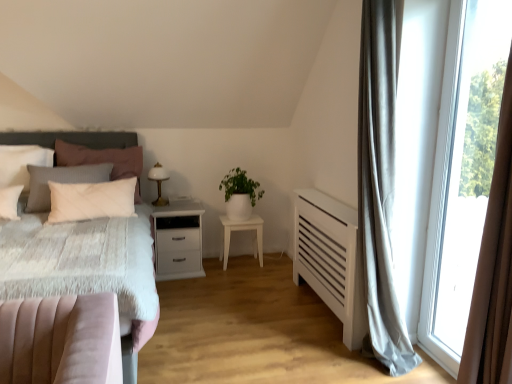
The image size is (512, 384). Find the location of `vacant region below white matte nightstand at center, the 2th nightstand from the left (from a real-world perspective)`. vacant region below white matte nightstand at center, the 2th nightstand from the left (from a real-world perspective) is located at coordinates (240, 264).